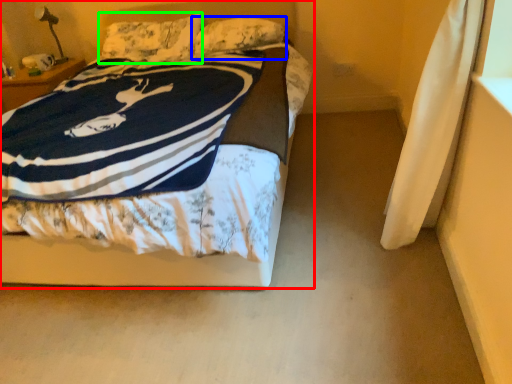
Question: Which is farther away from bed (highlighted by a red box)? pillow (highlighted by a blue box) or pillow (highlighted by a green box)?

Choices:
 (A) pillow
 (B) pillow

Answer: (B)